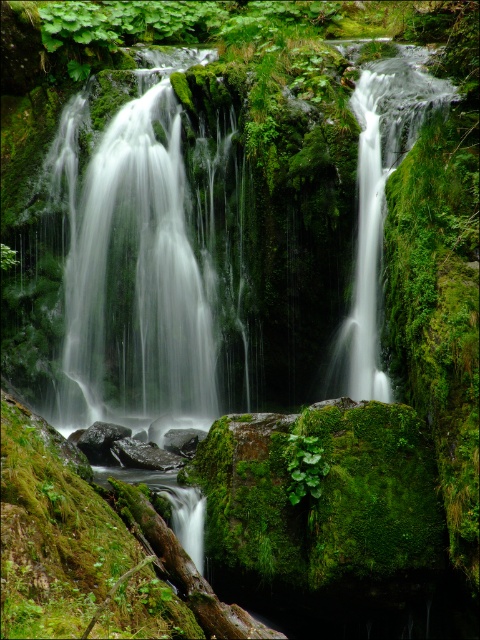
You are a hiker carrying a 10 feet long ladder. You need to place it between the green mossy waterfall at center and the white smooth waterfall at center. Can the ladder fit between them without bending?

The distance between the green mossy waterfall at center and the white smooth waterfall at center is 9.95 feet. Since the ladder is 10 feet long, it cannot fit between them without bending because the distance is slightly shorter than the ladder.

You are a photographer who wants to capture the green mossy waterfall at center and the white smooth waterfall at center in a single shot. Which waterfall should you focus on if you want to highlight the larger one in your composition?

The green mossy waterfall at center is larger in size than the white smooth waterfall at center, so you should focus on the green mossy waterfall at center to highlight the larger one in your composition.